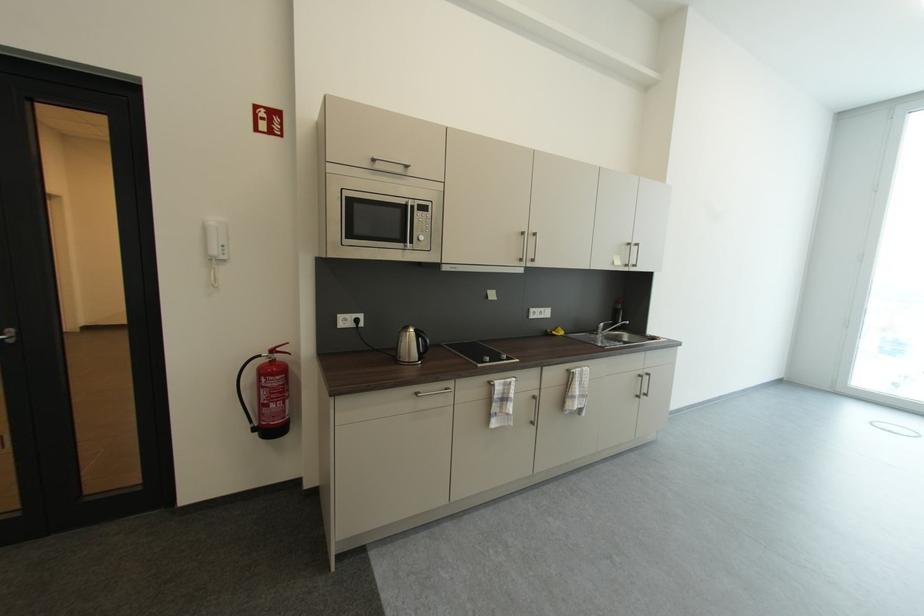
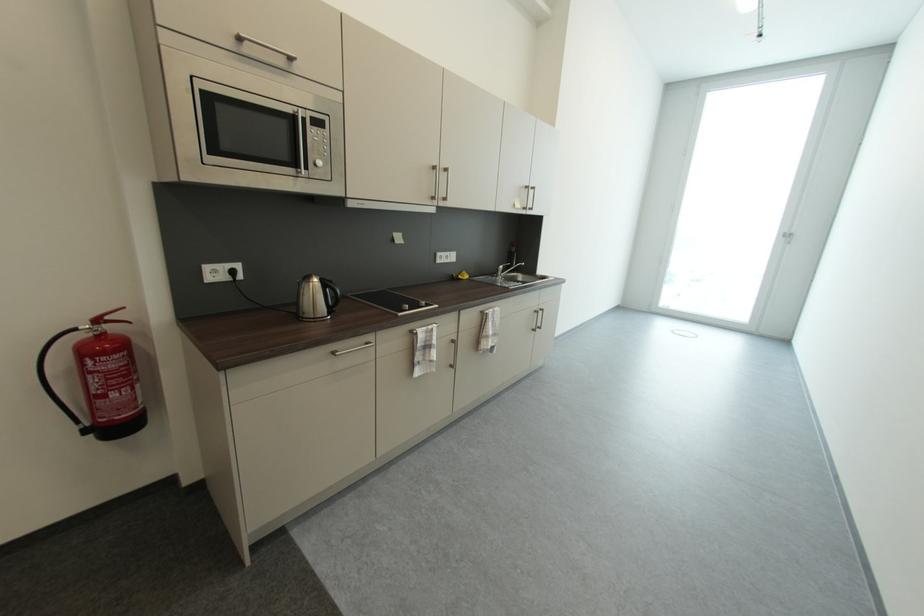
Which direction would the cameraman need to move to produce the second image?

The cameraman moved toward left, forward.